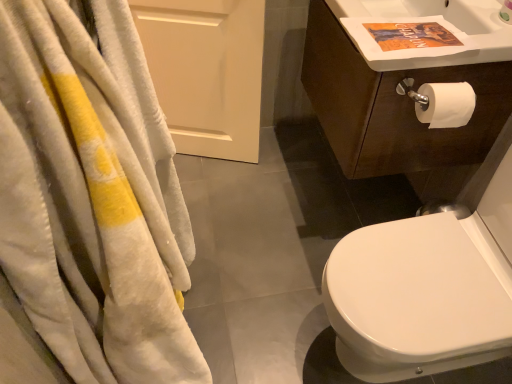
Where is `vacant space in white glossy sink at upper right (from a real-world perspective)`? The image size is (512, 384). vacant space in white glossy sink at upper right (from a real-world perspective) is located at coordinates (403, 34).